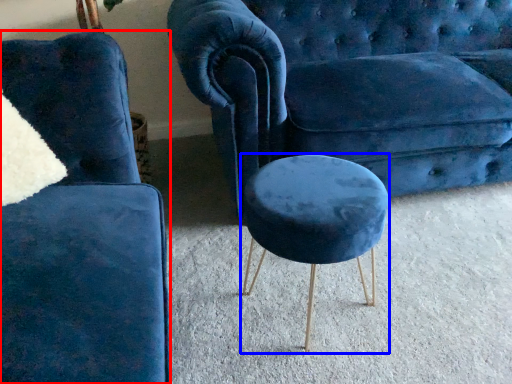
Question: Which of the following is the closest to the observer, chair (highlighted by a red box) or stool (highlighted by a blue box)?

Choices:
 (A) chair
 (B) stool

Answer: (A)